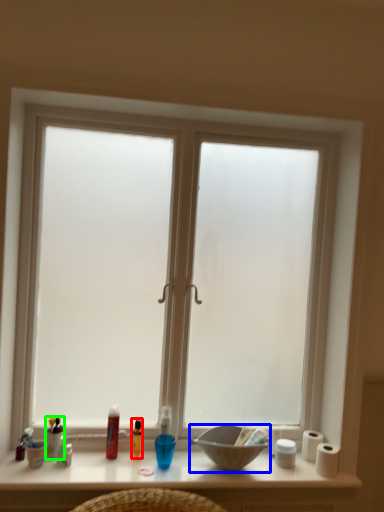
Question: Based on their relative distances, which object is nearer to toiletry (highlighted by a red box)? Choose from bowl (highlighted by a blue box) and toiletry (highlighted by a green box).

Choices:
 (A) bowl
 (B) toiletry

Answer: (B)